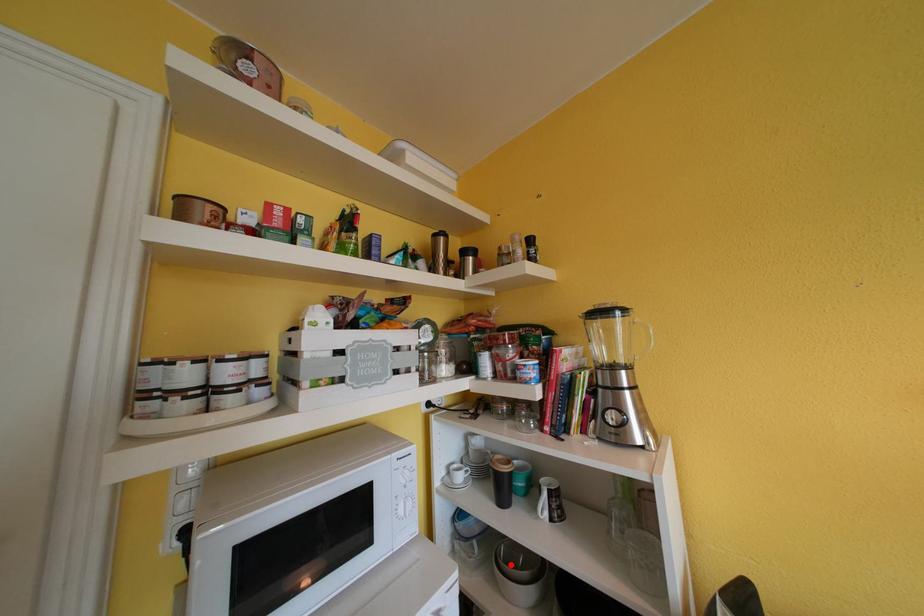
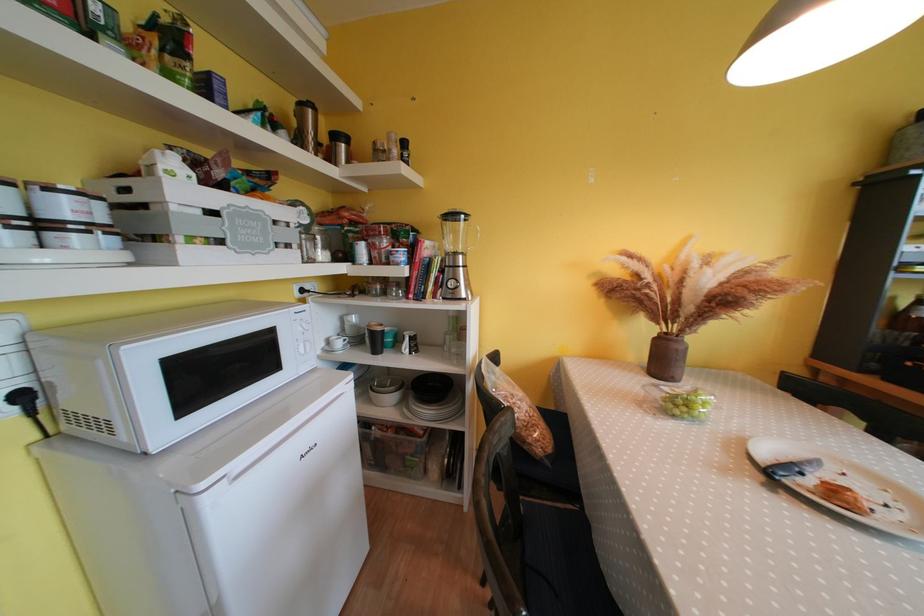
Question: I am providing you with two images of the same scene from different viewpoints. A red point is marked on the first image. Is the red point's position out of view in image 2?

Choices:
 (A) Yes
 (B) No

Answer: (B)